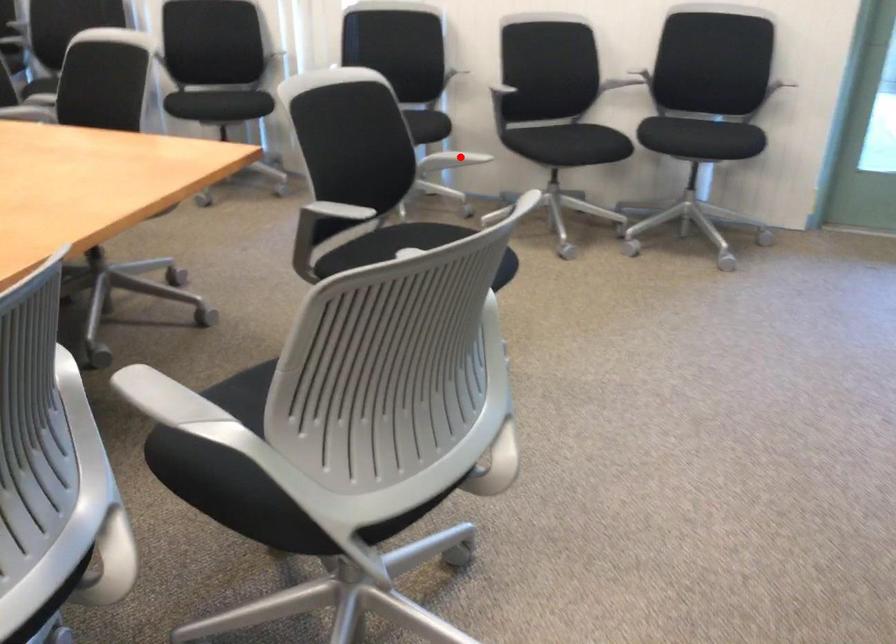
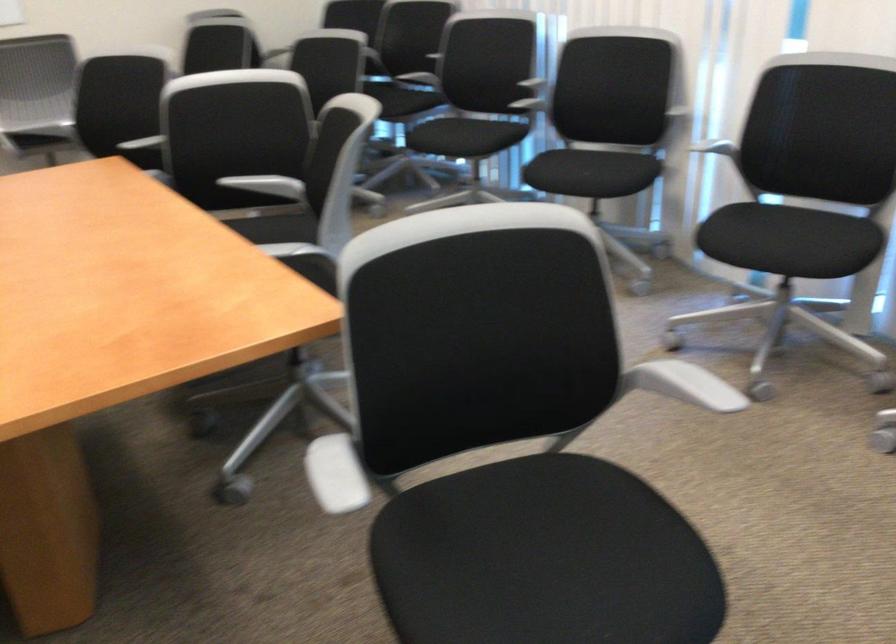
Question: I am providing you with two images of the same scene from different viewpoints. Image1 has a red point marked. In image2, the corresponding 3D location appears at what relative position? Reply with the corresponding letter.

Choices:
 (A) Closer
 (B) Farther

Answer: (A)